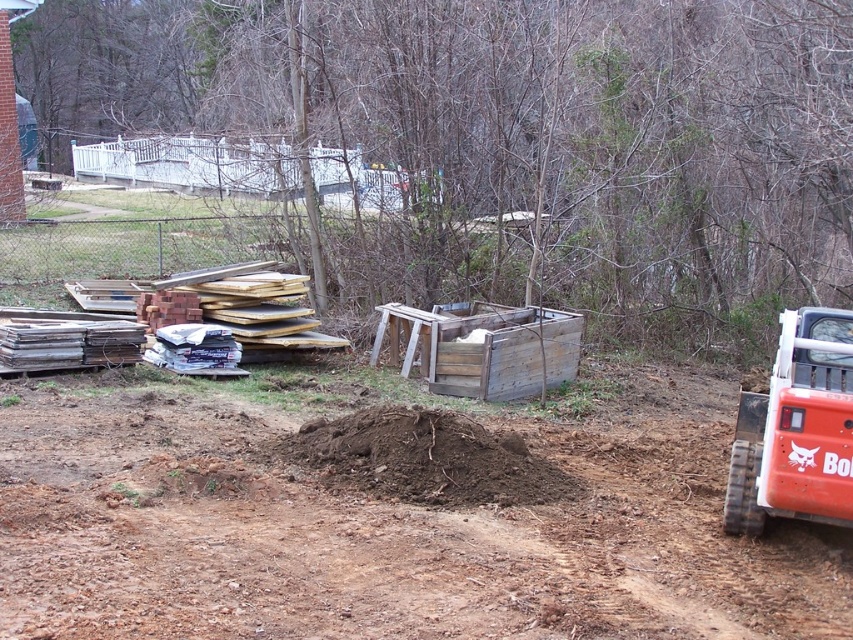
Question: Which point is farther from the camera taking this photo?

Choices:
 (A) (757, 522)
 (B) (68, 602)

Answer: (A)

Question: Is orange rubber track at right bigger than weathered wood crate at center?

Choices:
 (A) no
 (B) yes

Answer: (A)

Question: From the image, what is the correct spatial relationship of orange rubber track at right in relation to brown soil at center?

Choices:
 (A) below
 (B) above

Answer: (B)

Question: Which is nearer to the brown soil at lower right?

Choices:
 (A) orange rubber track at right
 (B) weathered wood crate at center

Answer: (A)

Question: Can you confirm if orange rubber track at right is smaller than weathered wood crate at center?

Choices:
 (A) no
 (B) yes

Answer: (B)

Question: Which of the following is the closest to the observer?

Choices:
 (A) (404, 412)
 (B) (44, 468)
 (C) (508, 307)
 (D) (741, 477)

Answer: (D)